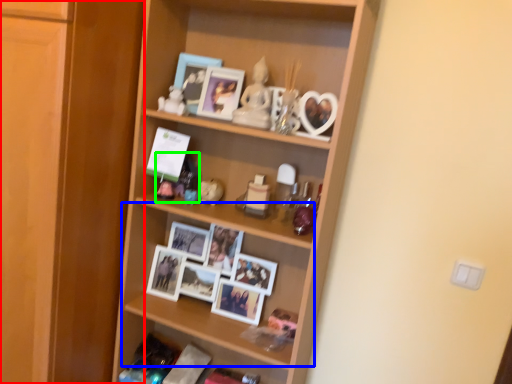
Question: Estimate the real-world distances between objects in this image. Which object is closer to cabinetry (highlighted by a red box), shelf (highlighted by a blue box) or toy (highlighted by a green box)?

Choices:
 (A) shelf
 (B) toy

Answer: (B)